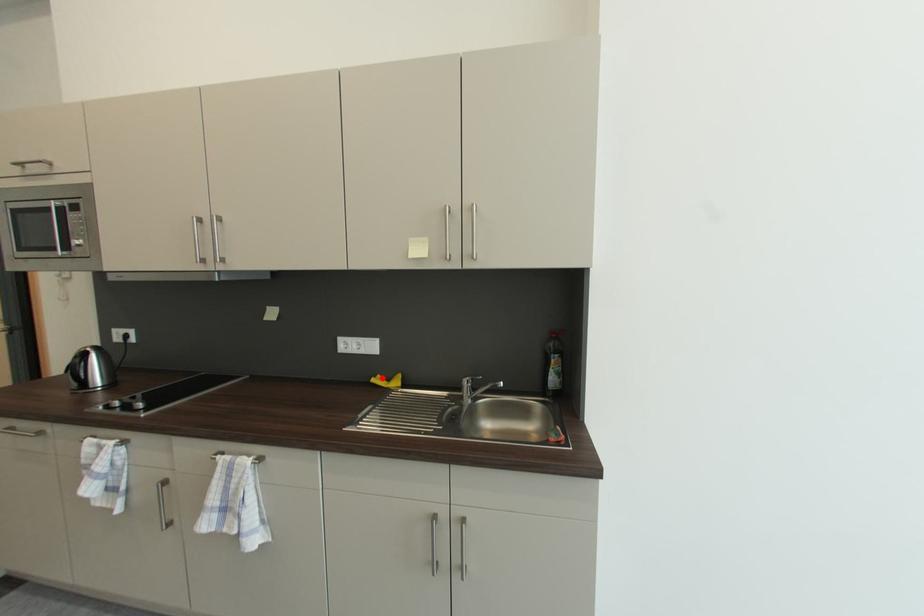
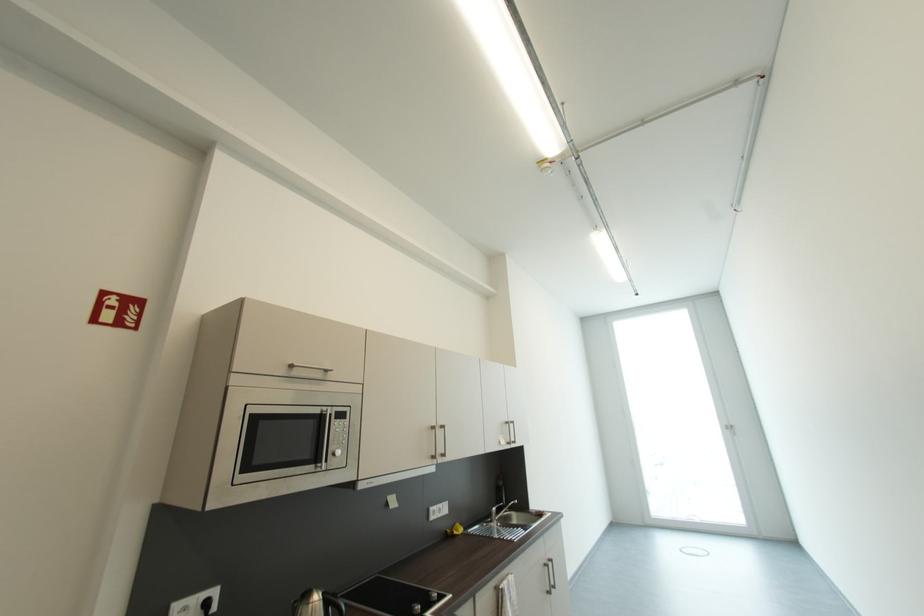
Question: A red point is marked in image1. In image2, is the corresponding 3D point closer to the camera or farther? Reply with the corresponding letter.

Choices:
 (A) The corresponding 3D point is closer.
 (B) The corresponding 3D point is farther.

Answer: (B)